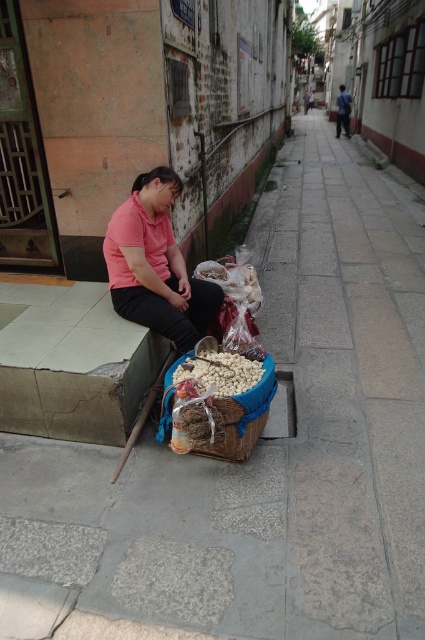
Question: Which of the following is the closest to the observer?

Choices:
 (A) (337, 116)
 (B) (127, 250)

Answer: (B)

Question: Can you confirm if blue woven basket at center is smaller than matte pink shirt at center?

Choices:
 (A) yes
 (B) no

Answer: (A)

Question: Is pink matte shirt at center wider than white matte nuts at center?

Choices:
 (A) no
 (B) yes

Answer: (B)

Question: Among these points, which one is farthest from the camera?

Choices:
 (A) (172, 378)
 (B) (345, 115)

Answer: (B)

Question: Among these points, which one is farthest from the camera?

Choices:
 (A) (340, 106)
 (B) (204, 280)
 (C) (274, 392)
 (D) (192, 356)

Answer: (A)

Question: Is pink matte shirt at center to the right of matte pink shirt at center from the viewer's perspective?

Choices:
 (A) no
 (B) yes

Answer: (A)